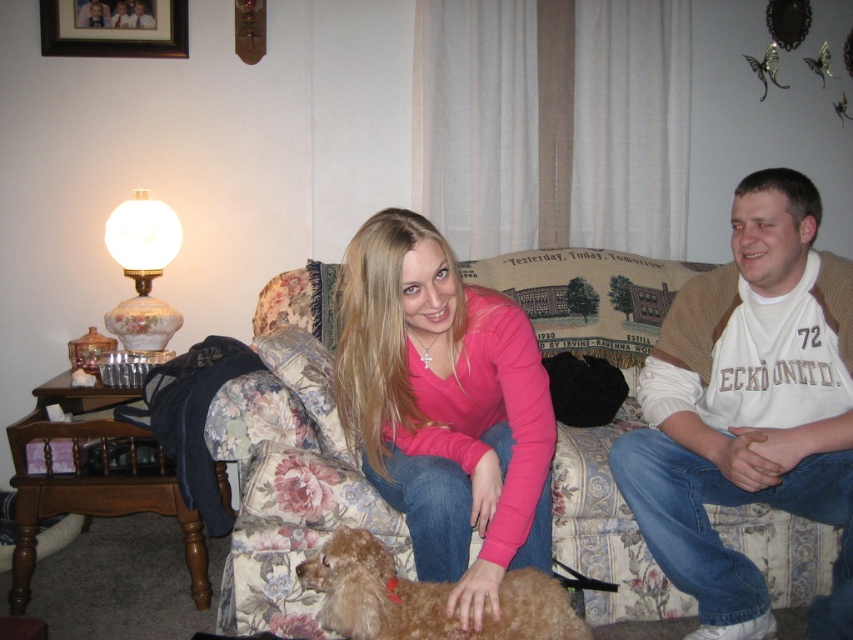
Question: Based on their relative distances, which object is farther from the brushed metal picture frame at upper left?

Choices:
 (A) matte pink sweater at center
 (B) white cotton shirt at center

Answer: (B)

Question: Which of the following is the closest to the observer?

Choices:
 (A) pink matte sweater at center
 (B) brushed metal picture frame at upper left
 (C) matte pink sweater at center

Answer: (A)

Question: Which object is the closest to the light brown fur at lower center?

Choices:
 (A) pink matte sweater at center
 (B) white cotton shirt at center
 (C) floral fabric couch at center
 (D) matte pink sweater at center

Answer: (A)

Question: Is floral fabric couch at center wider than pink matte sweater at center?

Choices:
 (A) no
 (B) yes

Answer: (B)

Question: Is floral fabric couch at center positioned before brushed metal picture frame at upper left?

Choices:
 (A) no
 (B) yes

Answer: (B)

Question: Does pink matte sweater at center have a greater width compared to matte pink sweater at center?

Choices:
 (A) no
 (B) yes

Answer: (B)